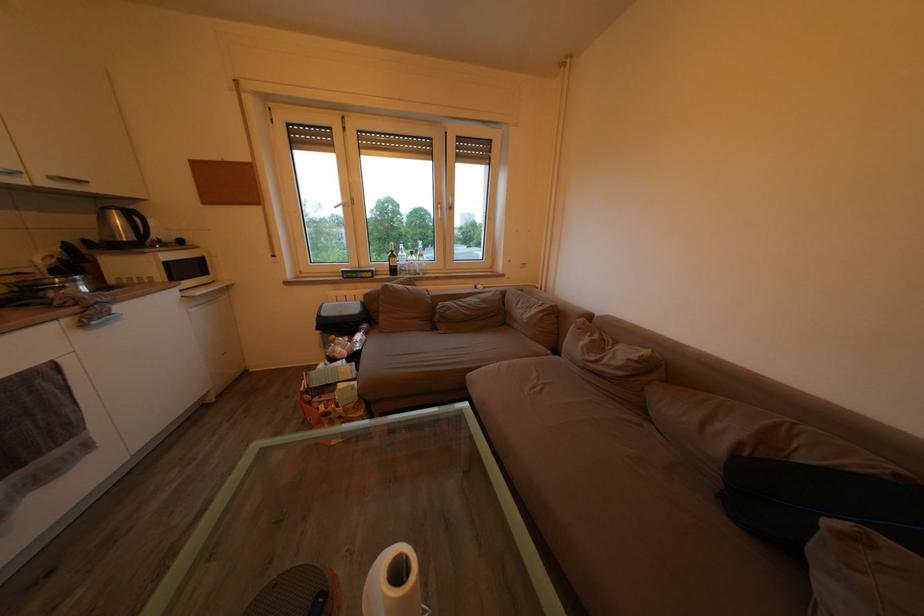
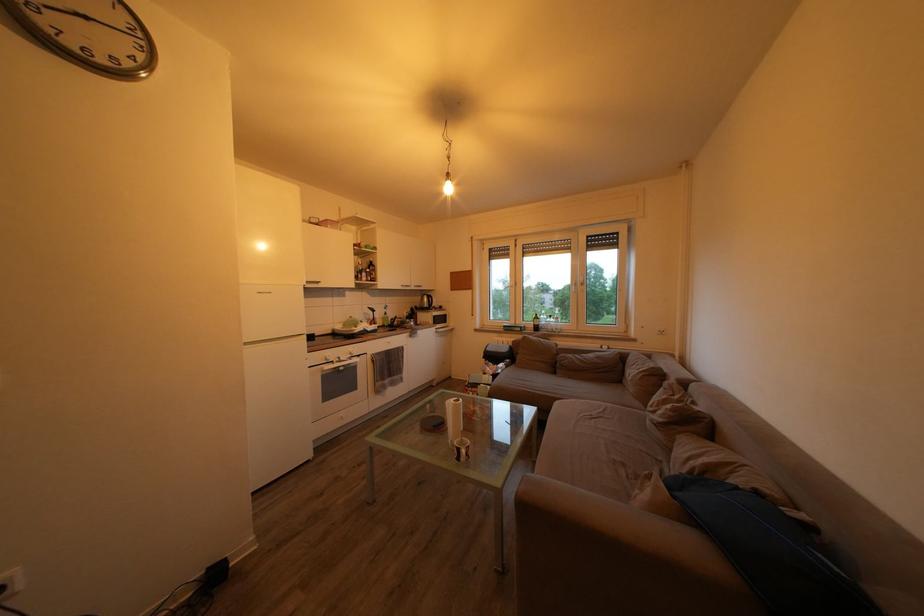
The point at (x=353, y=134) is marked in the first image. Where is the corresponding point in the second image?

(524, 252)